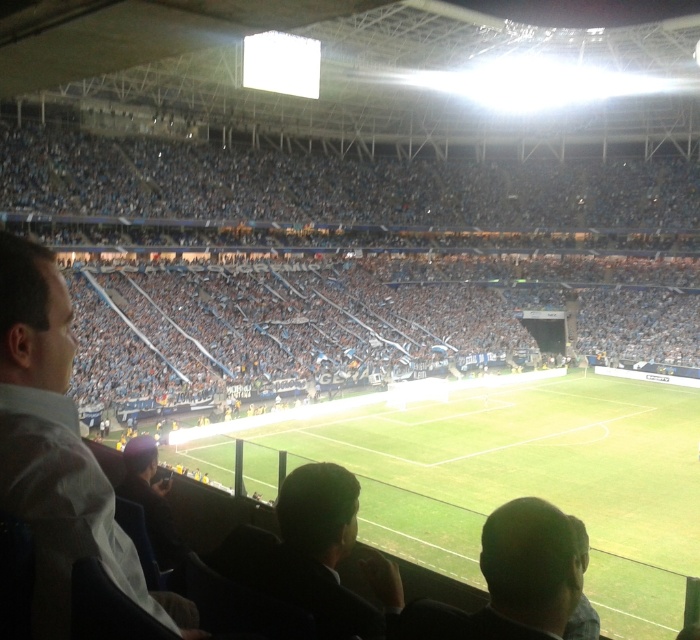
Question: Can you confirm if green grass football field at center is smaller than white shirt at left?

Choices:
 (A) yes
 (B) no

Answer: (B)

Question: Which object is farther from the camera taking this photo?

Choices:
 (A) dark brown hair at lower right
 (B) green grass football field at center
 (C) white shirt at left

Answer: (B)

Question: Can you confirm if white shirt at left is smaller than dark green fabric at lower center?

Choices:
 (A) no
 (B) yes

Answer: (A)

Question: Does green grass football field at center have a greater width compared to dark green fabric at lower center?

Choices:
 (A) no
 (B) yes

Answer: (B)

Question: Which point is closer to the camera?

Choices:
 (A) dark brown hair at lower right
 (B) green grass football field at center
 (C) dark green fabric at lower center

Answer: (A)

Question: Which point is closer to the camera taking this photo?

Choices:
 (A) [377, 486]
 (B) [385, 563]
 (C) [29, 369]
 (D) [496, 572]

Answer: (C)